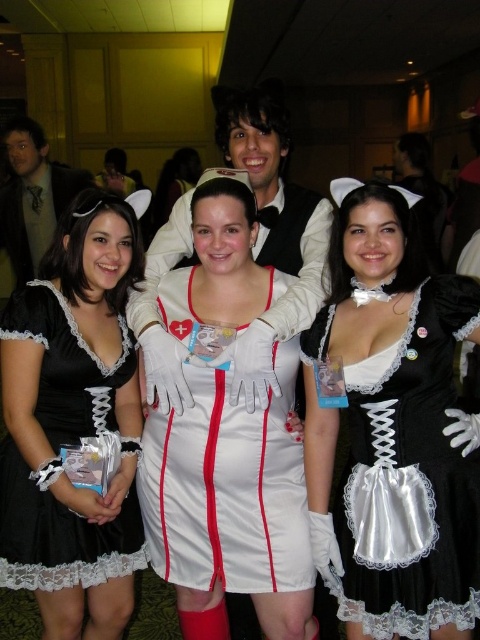
You are standing in front of the group of four individuals at the themed event. You need to find the exact position of the satin black dress at center. Can you tell me its 2D coordinates?

The satin black dress at center is located at the 2D coordinates of point (394, 429).